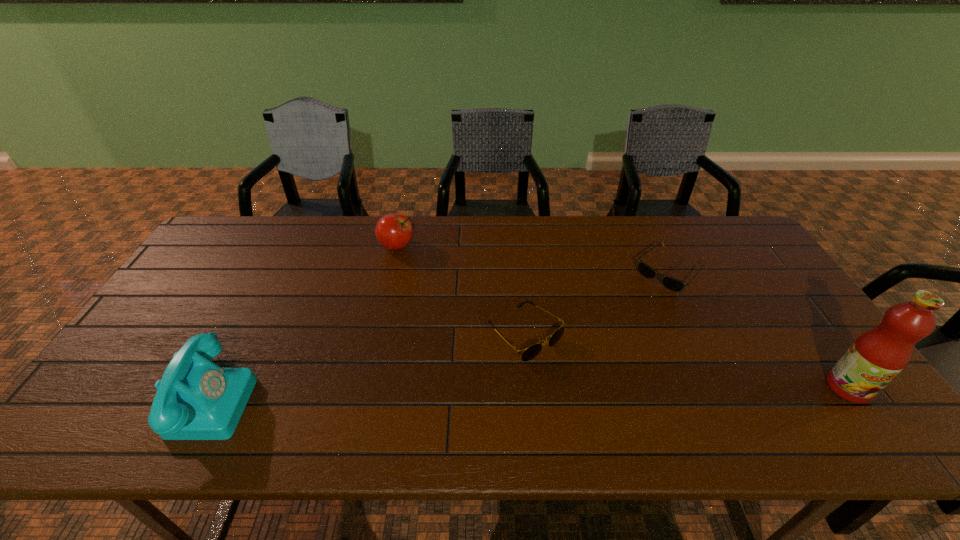
Find the location of a particular element. This screenshot has width=960, height=540. the fourth shortest object is located at coordinates (196, 399).

Where is `the leftmost object`? This screenshot has height=540, width=960. the leftmost object is located at coordinates (196, 399).

This screenshot has height=540, width=960. In order to click on the rightmost object in this screenshot , I will do (x=877, y=356).

Locate an element on the screen. The width and height of the screenshot is (960, 540). the tallest object is located at coordinates (877, 356).

Locate an element on the screen. The height and width of the screenshot is (540, 960). the second shortest object is located at coordinates (532, 351).

I want to click on the third object from left to right, so click(x=532, y=351).

Where is `the third tallest object`? the third tallest object is located at coordinates (393, 231).

What are the coordinates of `apple` in the screenshot? It's located at (393, 231).

This screenshot has width=960, height=540. Find the location of `the shortest object`. the shortest object is located at coordinates (670, 283).

The height and width of the screenshot is (540, 960). Find the location of `the shorter sunglasses`. the shorter sunglasses is located at coordinates (670, 283).